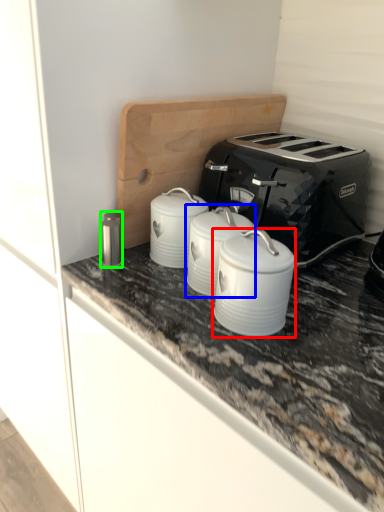
Question: Considering the real-world distances, which object is farthest from appliance (highlighted by a red box)? appliance (highlighted by a blue box) or appliance (highlighted by a green box)?

Choices:
 (A) appliance
 (B) appliance

Answer: (B)